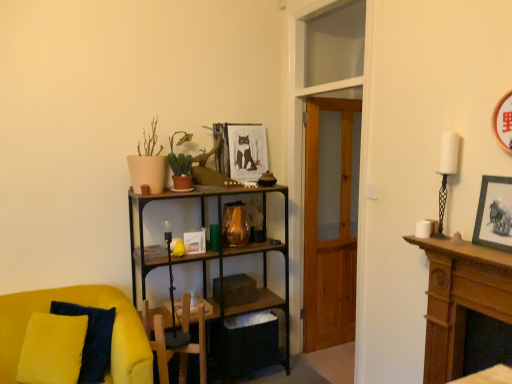
Question: From a real-world perspective, does wooden framed picture at center, marked as the 2th picture frame in a front-to-back arrangement, stand above green matte cactus at upper center, marked as the 1th houseplant in a back-to-front arrangement?

Choices:
 (A) yes
 (B) no

Answer: (A)

Question: Is wooden framed picture at center, marked as the second picture frame in a right-to-left arrangement, turned away from green matte cactus at upper center, marked as the 1th houseplant in a back-to-front arrangement?

Choices:
 (A) yes
 (B) no

Answer: (B)

Question: Is wooden framed picture at center, positioned as the first picture frame in back-to-front order, bigger than green matte cactus at upper center, marked as the 1th houseplant in a back-to-front arrangement?

Choices:
 (A) no
 (B) yes

Answer: (A)

Question: Can you confirm if wooden framed picture at center, positioned as the first picture frame in back-to-front order, is wider than green matte cactus at upper center, marked as the 1th houseplant in a back-to-front arrangement?

Choices:
 (A) yes
 (B) no

Answer: (B)

Question: Is the position of wooden framed picture at center, marked as the 2th picture frame in a front-to-back arrangement, less distant than that of green matte cactus at upper center, which is counted as the second houseplant, starting from the front?

Choices:
 (A) no
 (B) yes

Answer: (A)

Question: In terms of width, does green matte cactus at upper center, marked as the 1th houseplant in a back-to-front arrangement, look wider or thinner when compared to beige matte pot at upper left, placed as the first houseplant when sorted from front to back?

Choices:
 (A) thin
 (B) wide

Answer: (A)

Question: Based on their positions, is green matte cactus at upper center, which is counted as the second houseplant, starting from the front, located to the left or right of beige matte pot at upper left, placed as the first houseplant when sorted from front to back?

Choices:
 (A) right
 (B) left

Answer: (A)

Question: Is green matte cactus at upper center, marked as the 1th houseplant in a back-to-front arrangement, spatially inside beige matte pot at upper left, placed as the first houseplant when sorted from front to back, or outside of it?

Choices:
 (A) outside
 (B) inside

Answer: (A)

Question: From a real-world perspective, is green matte cactus at upper center, which is counted as the second houseplant, starting from the front, positioned above or below beige matte pot at upper left, arranged as the 2th houseplant when viewed from the back?

Choices:
 (A) below
 (B) above

Answer: (A)

Question: Considering the positions of wooden swivel chair at center and beige matte pot at upper left, arranged as the 2th houseplant when viewed from the back, in the image, is wooden swivel chair at center bigger or smaller than beige matte pot at upper left, arranged as the 2th houseplant when viewed from the back,?

Choices:
 (A) big
 (B) small

Answer: (A)

Question: Would you say wooden swivel chair at center is to the left or to the right of beige matte pot at upper left, placed as the first houseplant when sorted from front to back, in the picture?

Choices:
 (A) left
 (B) right

Answer: (B)

Question: Is point (x=147, y=337) closer or farther from the camera than point (x=146, y=160)?

Choices:
 (A) closer
 (B) farther

Answer: (A)

Question: Looking at their shapes, would you say wooden swivel chair at center is wider or thinner than beige matte pot at upper left, placed as the first houseplant when sorted from front to back?

Choices:
 (A) wide
 (B) thin

Answer: (B)

Question: Relative to matte black picture frame at upper right, the second picture frame in the top-to-bottom sequence, is beige matte pot at upper left, arranged as the 2th houseplant when viewed from the back, in front or behind?

Choices:
 (A) behind
 (B) front

Answer: (A)

Question: In terms of size, does beige matte pot at upper left, placed as the first houseplant when sorted from front to back, appear bigger or smaller than matte black picture frame at upper right, acting as the first picture frame starting from the right?

Choices:
 (A) small
 (B) big

Answer: (B)